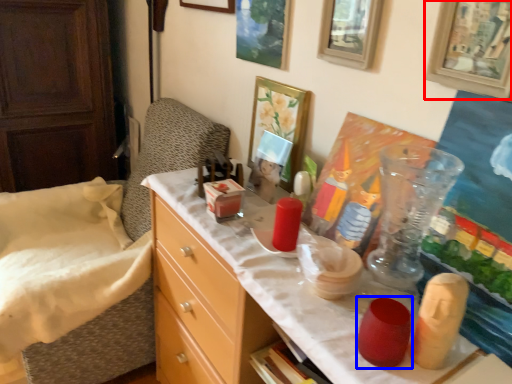
Question: Which object is closer to the camera taking this photo, picture frame (highlighted by a red box) or candle holder (highlighted by a blue box)?

Choices:
 (A) picture frame
 (B) candle holder

Answer: (A)